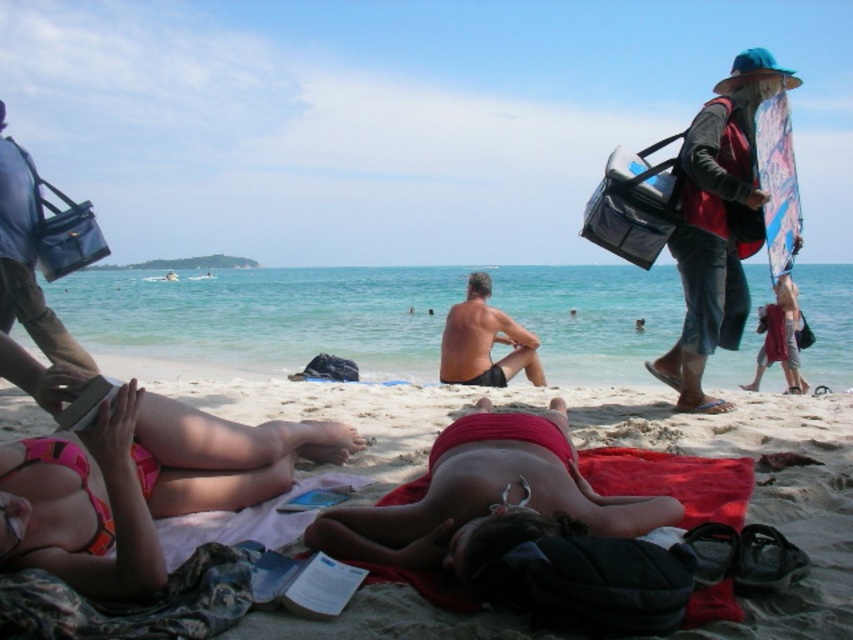
Between pink bikini at lower left and matte red bikini at center, which one appears on the left side from the viewer's perspective?

Positioned to the left is pink bikini at lower left.

The width and height of the screenshot is (853, 640). What do you see at coordinates (141, 484) in the screenshot? I see `pink bikini at lower left` at bounding box center [141, 484].

Who is more forward, (171, 429) or (434, 563)?

Point (434, 563)

At what (x,y) coordinates should I click in order to perform the action: click on pink bikini at lower left. Please return your answer as a coordinate pair (x, y). The height and width of the screenshot is (640, 853). Looking at the image, I should click on (141, 484).

Can you confirm if matte red bikini at center is smaller than red fabric towel at center?

Actually, matte red bikini at center might be larger than red fabric towel at center.

Does matte red bikini at center appear under red fabric towel at center?

Actually, matte red bikini at center is above red fabric towel at center.

What do you see at coordinates (486, 500) in the screenshot? Image resolution: width=853 pixels, height=640 pixels. I see `matte red bikini at center` at bounding box center [486, 500].

At what (x,y) coordinates should I click in order to perform the action: click on matte red bikini at center. Please return your answer as a coordinate pair (x, y). The height and width of the screenshot is (640, 853). Looking at the image, I should click on 486,500.

Is point (148, 419) in front of point (746, 161)?

Yes, it is.

What do you see at coordinates (141, 484) in the screenshot? This screenshot has width=853, height=640. I see `pink bikini at lower left` at bounding box center [141, 484].

Who is more distant from viewer, (x=125, y=397) or (x=699, y=132)?

Positioned behind is point (x=699, y=132).

Where is `pink bikini at lower left`? pink bikini at lower left is located at coordinates (141, 484).